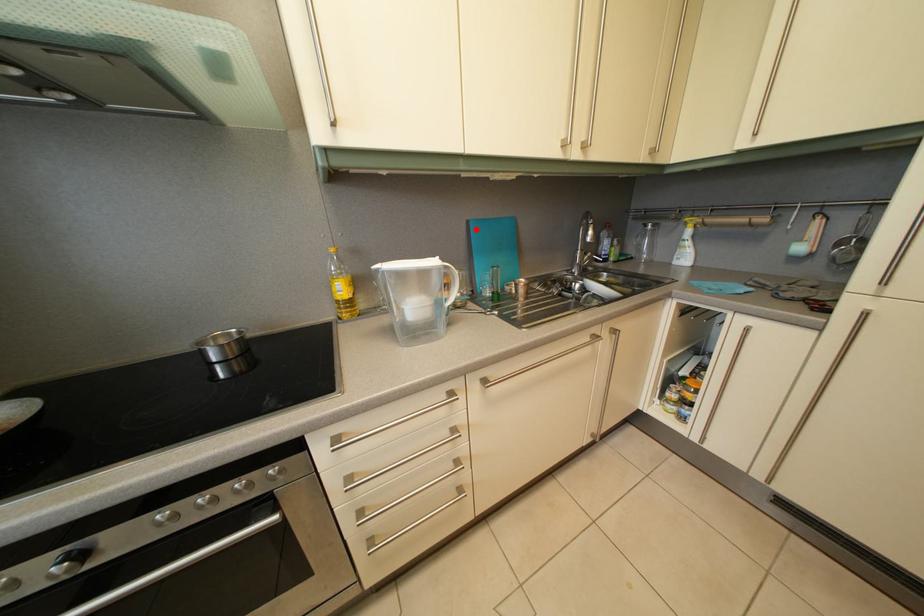
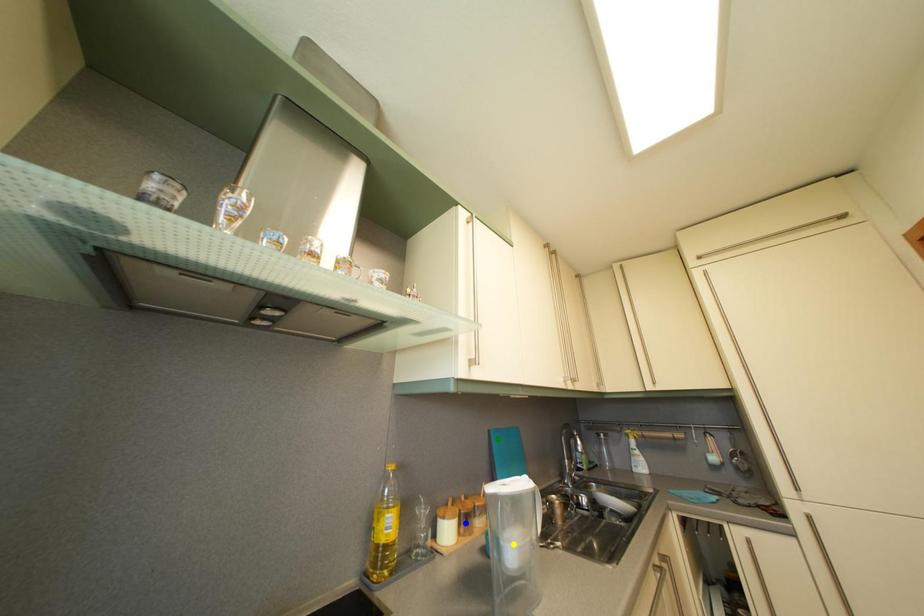
Question: I am providing you with two images of the same scene from different viewpoints. A red point is marked on the first image. You are given multiple points on the second image. Which point in image 2 is actually the same real-world point as the red point in image 1?

Choices:
 (A) green point
 (B) yellow point
 (C) blue point

Answer: (A)